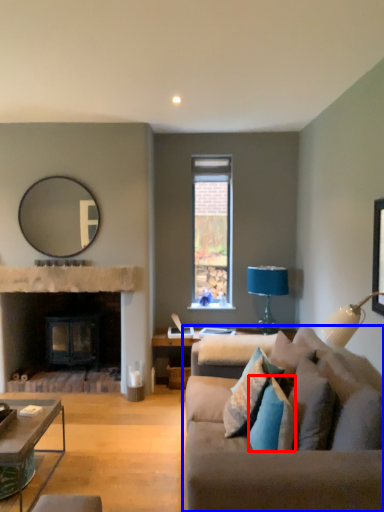
Question: Which of the following is the farthest to the observer, pillow (highlighted by a red box) or studio couch (highlighted by a blue box)?

Choices:
 (A) pillow
 (B) studio couch

Answer: (A)